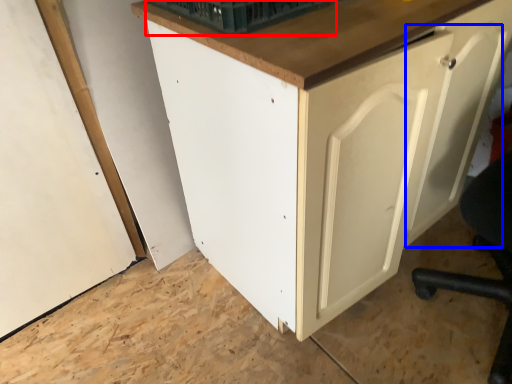
Question: Among these objects, which one is nearest to the camera, basket (highlighted by a red box) or door (highlighted by a blue box)?

Choices:
 (A) basket
 (B) door

Answer: (B)